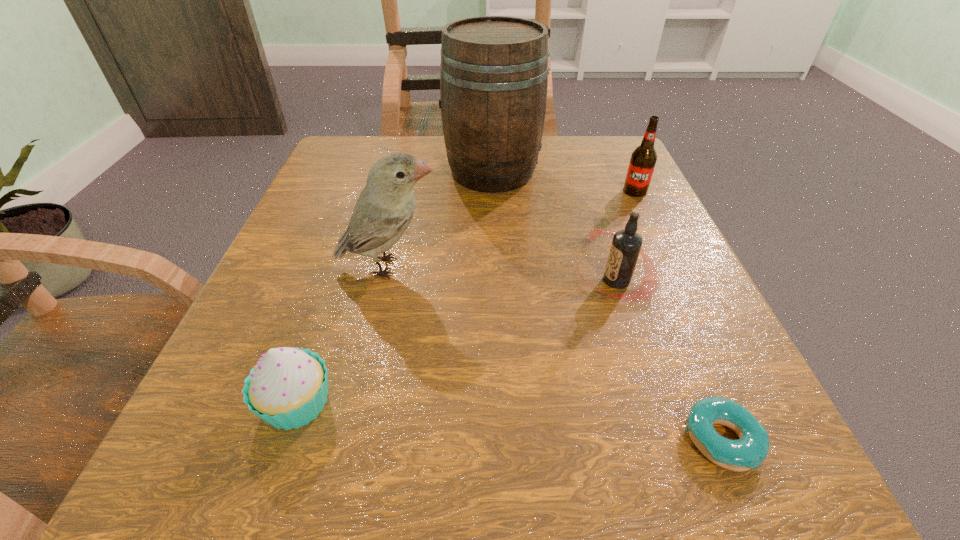
Where is `the tallest object`? The height and width of the screenshot is (540, 960). the tallest object is located at coordinates (494, 70).

Find the location of a particular element. The width and height of the screenshot is (960, 540). the fifth shortest object is located at coordinates (385, 207).

The image size is (960, 540). Find the location of `the farther root beer`. the farther root beer is located at coordinates (643, 159).

The height and width of the screenshot is (540, 960). I want to click on the nearer root beer, so click(x=626, y=245).

Locate an element on the screen. The width and height of the screenshot is (960, 540). the left root beer is located at coordinates (626, 245).

You are a GUI agent. You are given a task and a screenshot of the screen. Output one action in this format:
    pyautogui.click(x=<x>, y=<y>)
    Task: Click on the cupcake
    The image size is (960, 540).
    Given the screenshot: What is the action you would take?
    pyautogui.click(x=287, y=388)

Where is `the shortest object`? This screenshot has width=960, height=540. the shortest object is located at coordinates (751, 449).

Where is `vacant space situated on the side of the tallest object near the bung hole`? vacant space situated on the side of the tallest object near the bung hole is located at coordinates point(339,171).

I want to click on free region located on the side of the tallest object near the bung hole, so click(353, 171).

Find the location of a particular element. This screenshot has height=540, width=960. free space located 0.240m on the side of the tallest object near the bung hole is located at coordinates (329, 171).